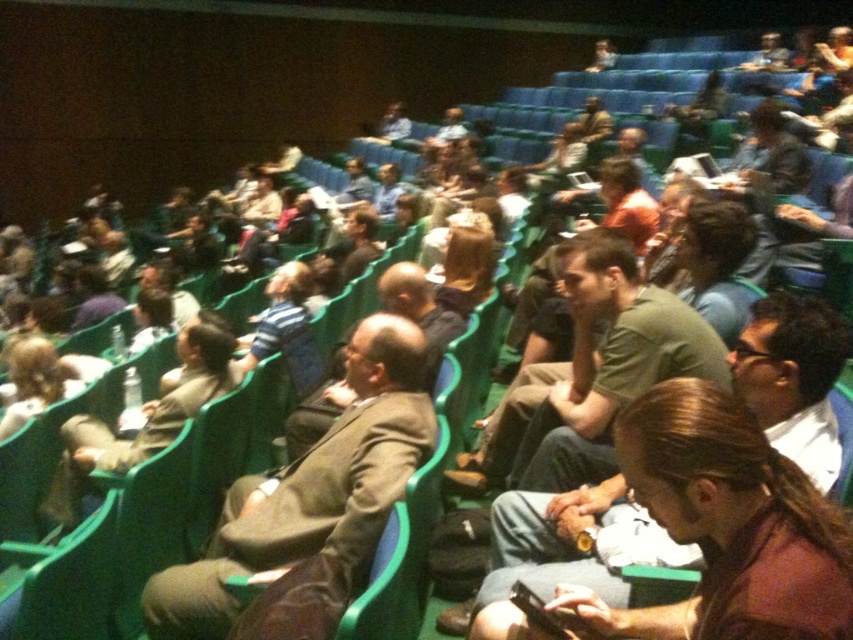
You are a photographer standing at the back of the auditorium. You want to take a photo of both the brown leather jacket at center and the green cotton shirt at center in the same frame. Given that your camera has a minimum focus distance of 20 inches, will you be able to capture both items clearly in the photo?

The brown leather jacket at center and green cotton shirt at center are 19.57 inches apart from each other, which is less than the camera minimum focus distance of 20 inches. Therefore, the camera can capture both items clearly in the same frame.

You are sitting in the front row of the auditorium and notice two people wearing a brown leather jacket at center and a green matte shirt at center. Which one is positioned more to the left side from your perspective?

The brown leather jacket at center is positioned more to the left side from your perspective because it is located to the left of the green matte shirt at center.